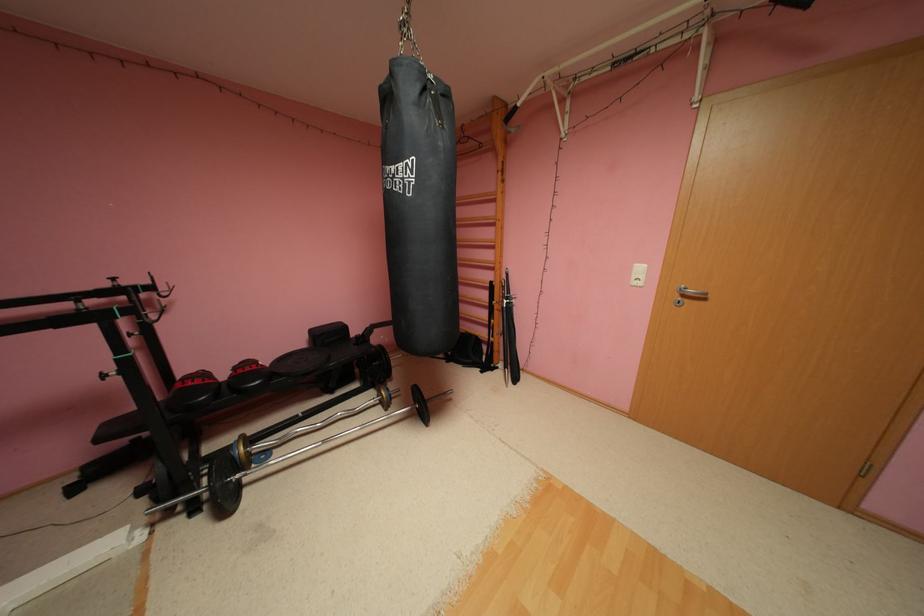
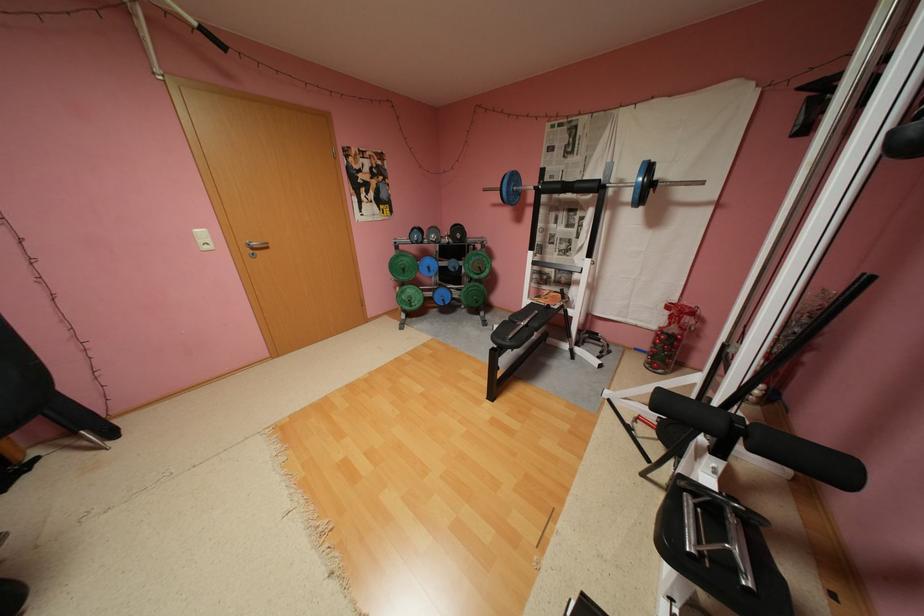
First-person continuous shooting, in which direction is the camera rotating?

The camera rotated toward right-down.